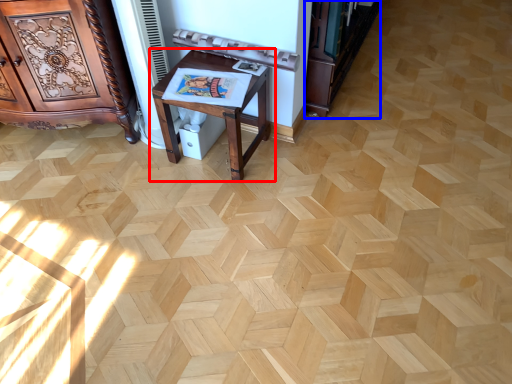
Question: Among these objects, which one is farthest to the camera, table (highlighted by a red box) or bookshelf (highlighted by a blue box)?

Choices:
 (A) table
 (B) bookshelf

Answer: (B)